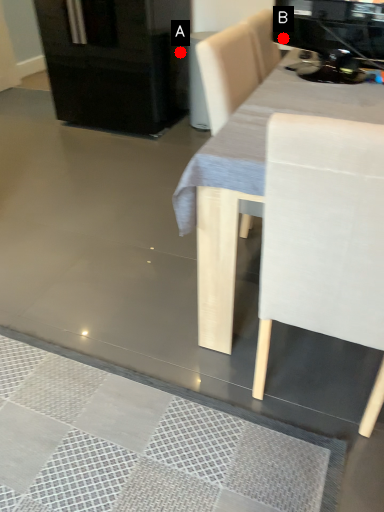
Question: Two points are circled on the image, labeled by A and B beside each circle. Which point is closer to the camera?

Choices:
 (A) A is closer
 (B) B is closer

Answer: (B)